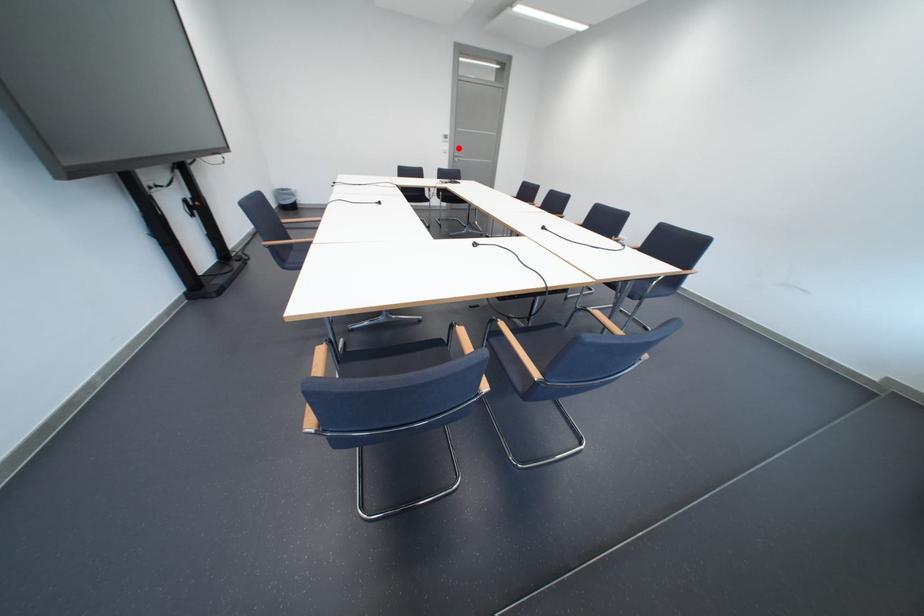
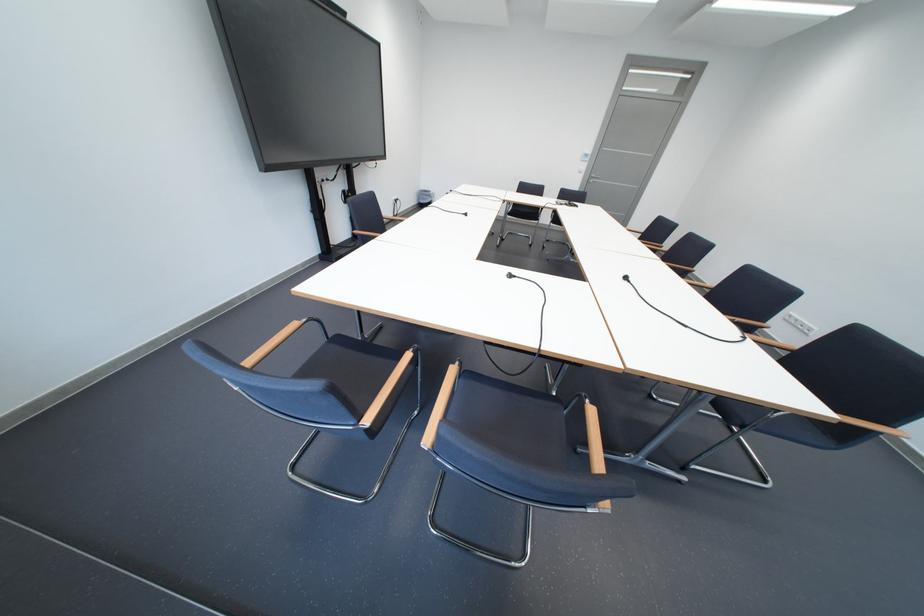
The point at the highlighted location is marked in the first image. Where is the corresponding point in the second image?

(596, 168)